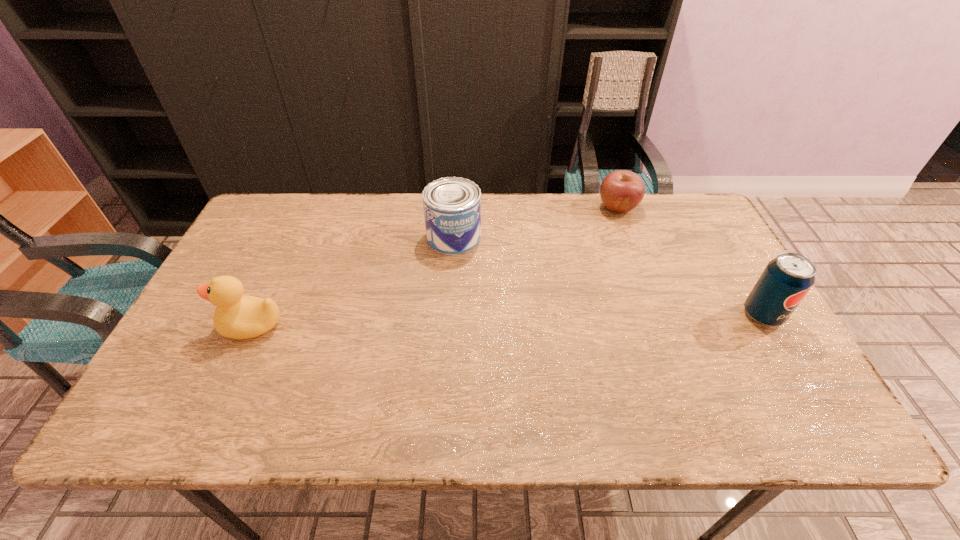
Where is `free spot on the desktop that is between the duck and the soda can and is positioned on the side of the shortest object with the unique marking`? Image resolution: width=960 pixels, height=540 pixels. free spot on the desktop that is between the duck and the soda can and is positioned on the side of the shortest object with the unique marking is located at coordinates (548, 319).

Identify the location of free space on the desktop that is between the leftmost object and the soda can and is positioned on the front label of the second object from left to right. The width and height of the screenshot is (960, 540). (441, 322).